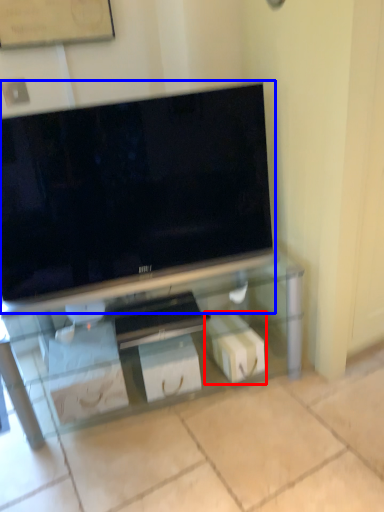
Question: Among these objects, which one is farthest to the camera, box (highlighted by a red box) or television (highlighted by a blue box)?

Choices:
 (A) box
 (B) television

Answer: (A)